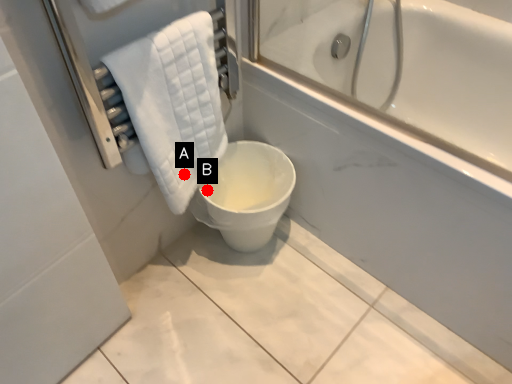
Question: Two points are circled on the image, labeled by A and B beside each circle. Among these points, which one is nearest to the camera?

Choices:
 (A) A is closer
 (B) B is closer

Answer: (A)